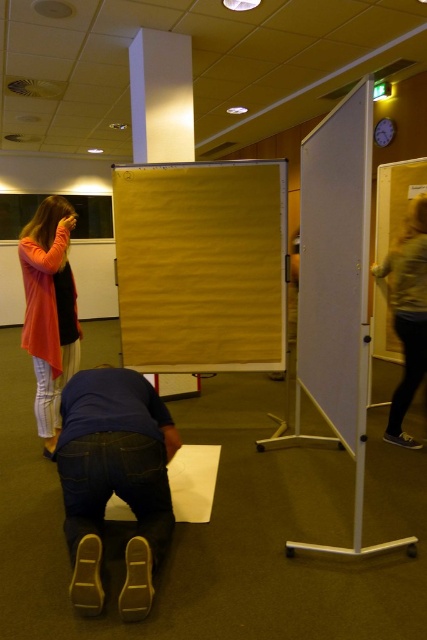
Question: Considering the real-world distances, which object is farthest from the light brown leather jacket at right?

Choices:
 (A) dark blue jeans at lower center
 (B) matte orange cardigan at left

Answer: (B)

Question: From the image, what is the correct spatial relationship of dark blue jeans at lower center in relation to matte orange cardigan at left?

Choices:
 (A) right
 (B) left

Answer: (A)

Question: Which object appears farthest from the camera in this image?

Choices:
 (A) matte orange cardigan at left
 (B) light brown leather jacket at right
 (C) dark blue jeans at lower center

Answer: (B)

Question: Estimate the real-world distances between objects in this image. Which object is closer to the light brown leather jacket at right?

Choices:
 (A) matte orange cardigan at left
 (B) dark blue jeans at lower center

Answer: (B)

Question: Can you confirm if dark blue jeans at lower center is positioned above matte orange cardigan at left?

Choices:
 (A) no
 (B) yes

Answer: (A)

Question: Does matte orange cardigan at left have a larger size compared to light brown leather jacket at right?

Choices:
 (A) no
 (B) yes

Answer: (B)